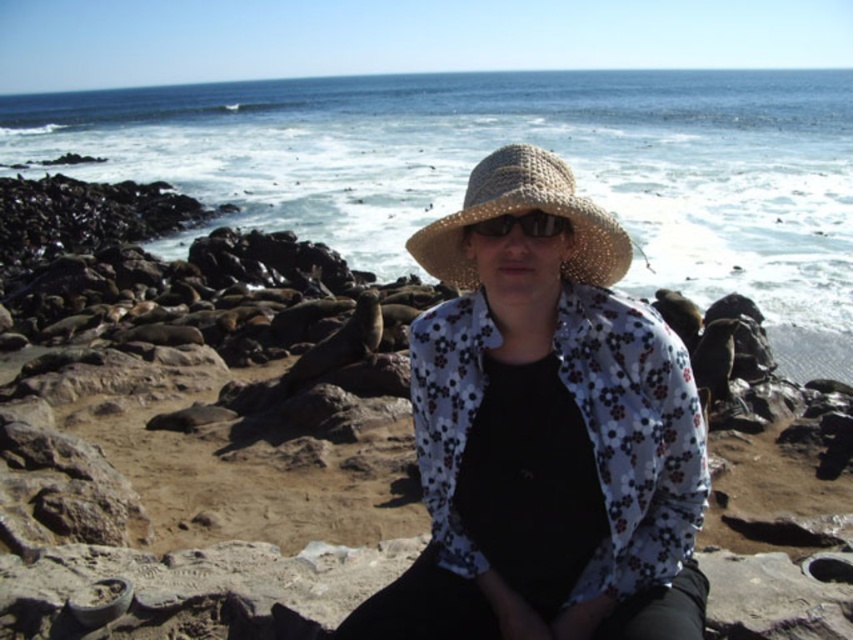
You are standing at the shoreline in the image and want to move from point A to point B. Point A is located at coordinates point [698,490] and point B is at point [498,225]. Which point is closer to you when you start at the shoreline?

Point A at point [698,490] is closer to you because it is further to the viewer than point B at point [498,225], meaning it is physically nearer in the scene.